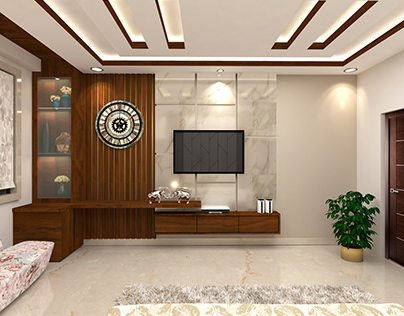
This screenshot has width=404, height=316. What are the coordinates of `plant` in the screenshot? It's located at (355, 222).